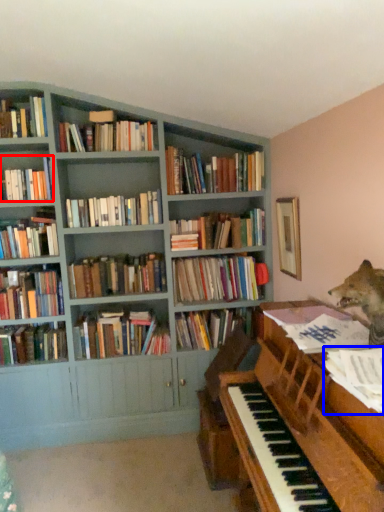
Question: Which of the following is the closest to the observer, book (highlighted by a red box) or book (highlighted by a blue box)?

Choices:
 (A) book
 (B) book

Answer: (B)